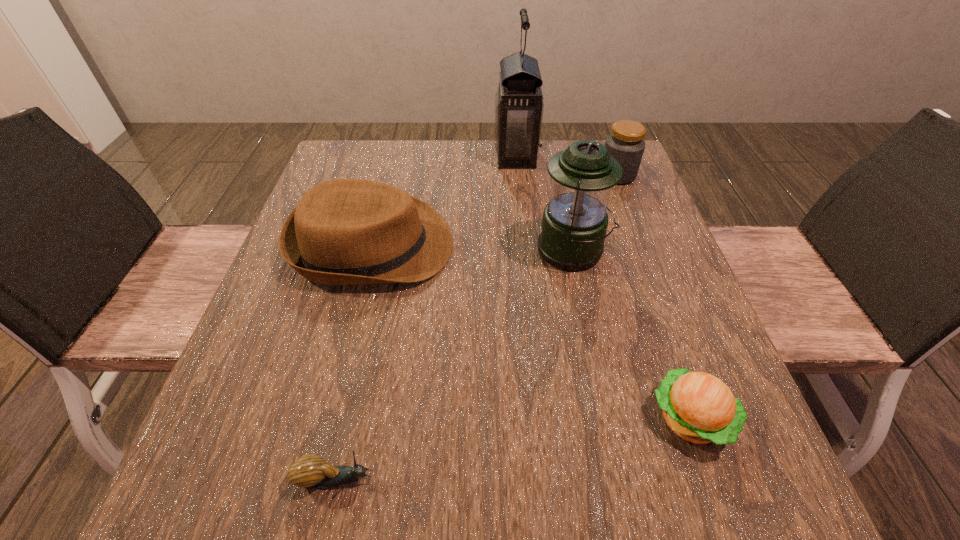
Identify the location of free space located 0.090m on the front-facing side of the taller lantern. (462, 156).

Locate an element on the screen. vacant area situated 0.250m on the front-facing side of the taller lantern is located at coordinates (403, 156).

Find the location of `vacant space located 0.160m on the front-facing side of the taller lantern`. vacant space located 0.160m on the front-facing side of the taller lantern is located at coordinates (436, 156).

The height and width of the screenshot is (540, 960). I want to click on free space located 0.310m on the front of the shorter lantern, so click(609, 418).

You are a GUI agent. You are given a task and a screenshot of the screen. Output one action in this format:
    pyautogui.click(x=<x>, y=<y>)
    Task: Click on the vacant region located on the surface of the jar near the warning symbol
    Image resolution: width=960 pixels, height=540 pixels.
    Given the screenshot: What is the action you would take?
    pyautogui.click(x=538, y=176)

What are the coordinates of `blank space located 0.280m on the surface of the jar near the warning symbol` in the screenshot? It's located at (492, 176).

Image resolution: width=960 pixels, height=540 pixels. I want to click on vacant space situated 0.280m on the surface of the jar near the warning symbol, so click(492, 176).

Locate an element on the screen. vacant area located 0.300m on the front-facing side of the fedora is located at coordinates (591, 246).

Where is `vacant space located 0.380m on the left of the hamburger`? Image resolution: width=960 pixels, height=540 pixels. vacant space located 0.380m on the left of the hamburger is located at coordinates (404, 418).

Where is `free space located on the front-facing side of the shortest object`? The width and height of the screenshot is (960, 540). free space located on the front-facing side of the shortest object is located at coordinates (612, 478).